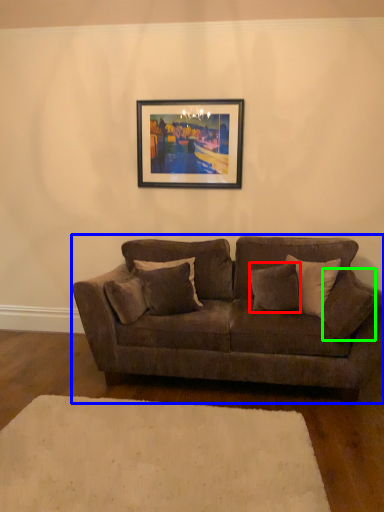
Question: Based on their relative distances, which object is farther from pillow (highlighted by a red box)? Choose from studio couch (highlighted by a blue box) and pillow (highlighted by a green box).

Choices:
 (A) studio couch
 (B) pillow

Answer: (A)